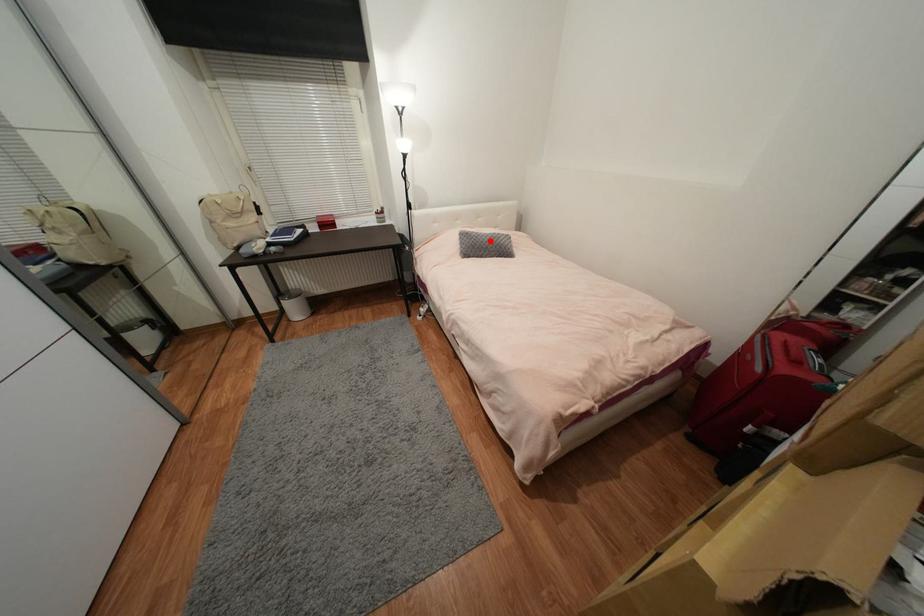
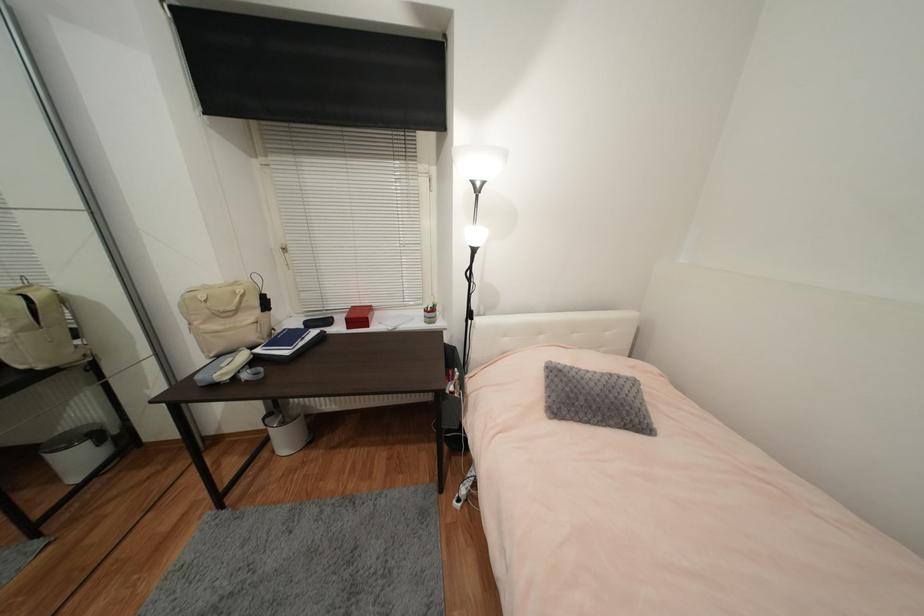
In the second image, find the point that corresponds to the highlighted location in the first image.

(602, 391)